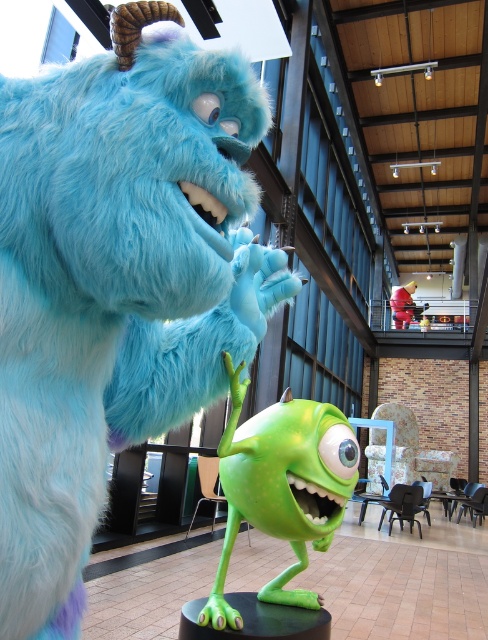
Question: Which object appears closest to the camera in this image?

Choices:
 (A) fluffy blue fur at center
 (B) green rubbery mike at center

Answer: (A)

Question: Which point is farther to the camera?

Choices:
 (A) (411, 316)
 (B) (340, 513)
 (C) (68, 440)

Answer: (A)

Question: Which of the following is the farthest from the observer?

Choices:
 (A) rubberized red toy at center
 (B) green rubbery mike at center
 (C) fluffy blue fur at center

Answer: (A)

Question: Is fluffy blue fur at center thinner than green rubbery mike at center?

Choices:
 (A) yes
 (B) no

Answer: (A)

Question: Does fluffy blue fur at center have a larger size compared to rubberized red toy at center?

Choices:
 (A) no
 (B) yes

Answer: (A)

Question: Can you confirm if green rubbery mike at center is positioned to the left of rubberized red toy at center?

Choices:
 (A) yes
 (B) no

Answer: (A)